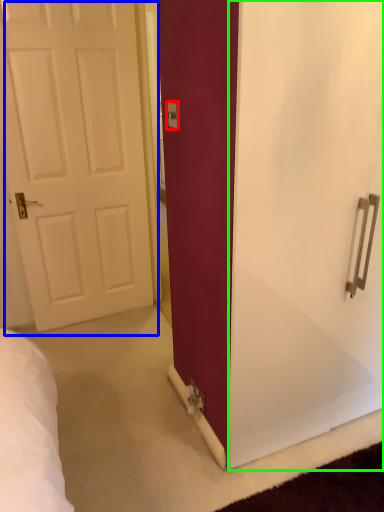
Question: Which is farther away from electric outlet (highlighted by a red box)? door (highlighted by a blue box) or screen door (highlighted by a green box)?

Choices:
 (A) door
 (B) screen door

Answer: (A)